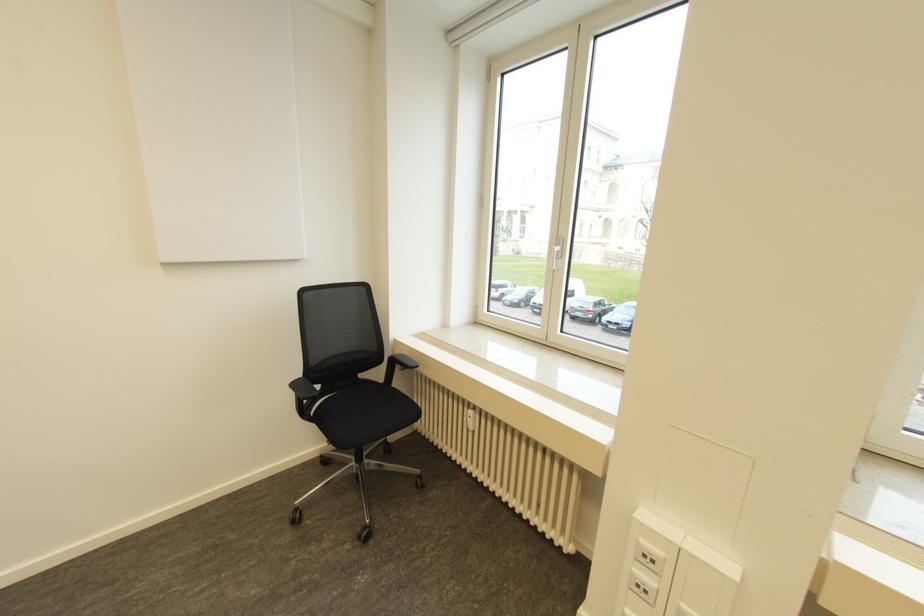
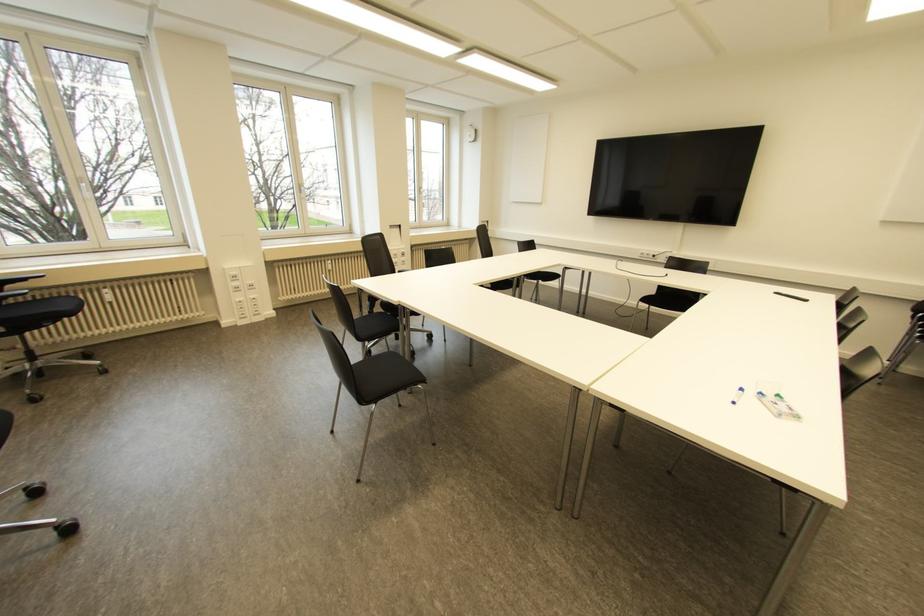
Locate, in the second image, the point that corresponds to pixel 469 411 in the first image.

(104, 290)